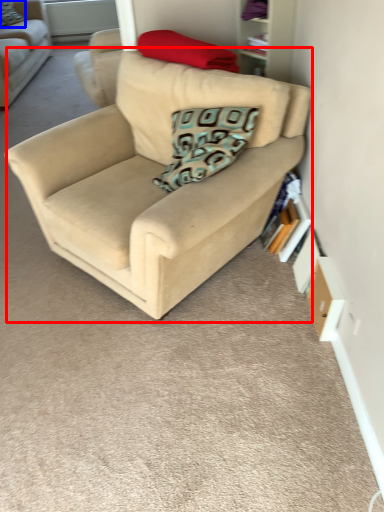
Question: Which point is closer to the camera, studio couch (highlighted by a red box) or pillow (highlighted by a blue box)?

Choices:
 (A) studio couch
 (B) pillow

Answer: (A)